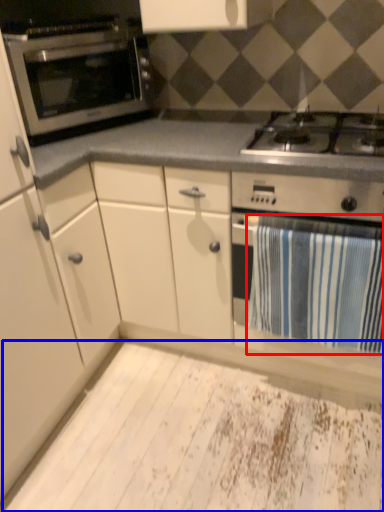
Question: Which object is further to the camera taking this photo, bath towel (highlighted by a red box) or plywood (highlighted by a blue box)?

Choices:
 (A) bath towel
 (B) plywood

Answer: (A)